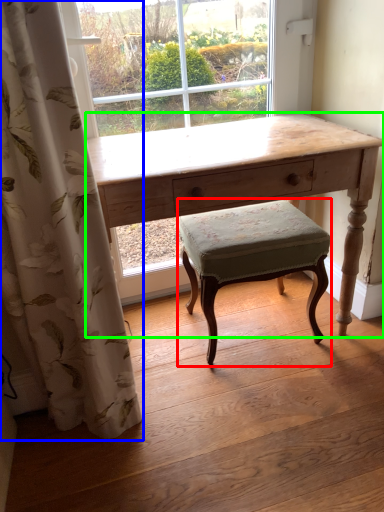
Question: Which object is the closest to the stool (highlighted by a red box)? Choose among these: curtain (highlighted by a blue box) or desk (highlighted by a green box).

Choices:
 (A) curtain
 (B) desk

Answer: (B)